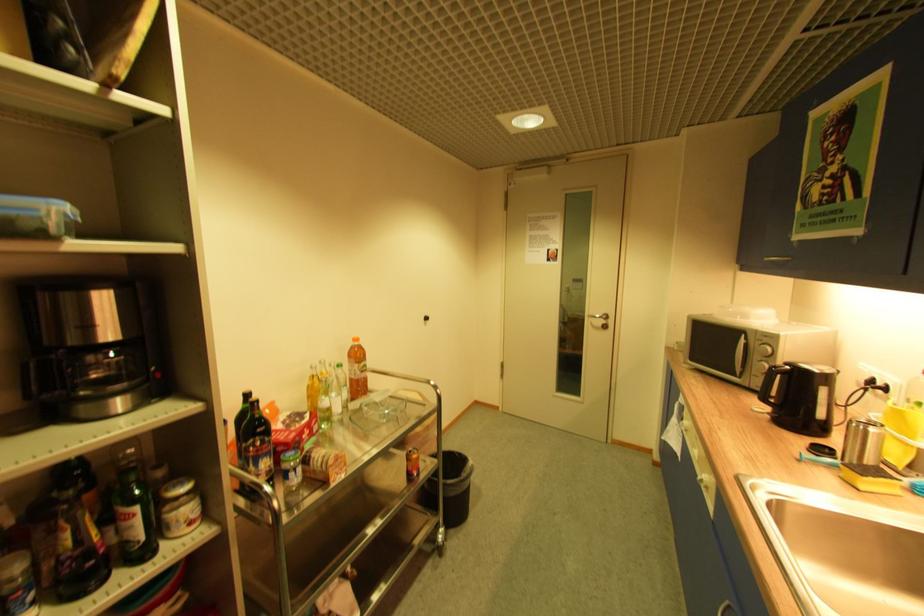
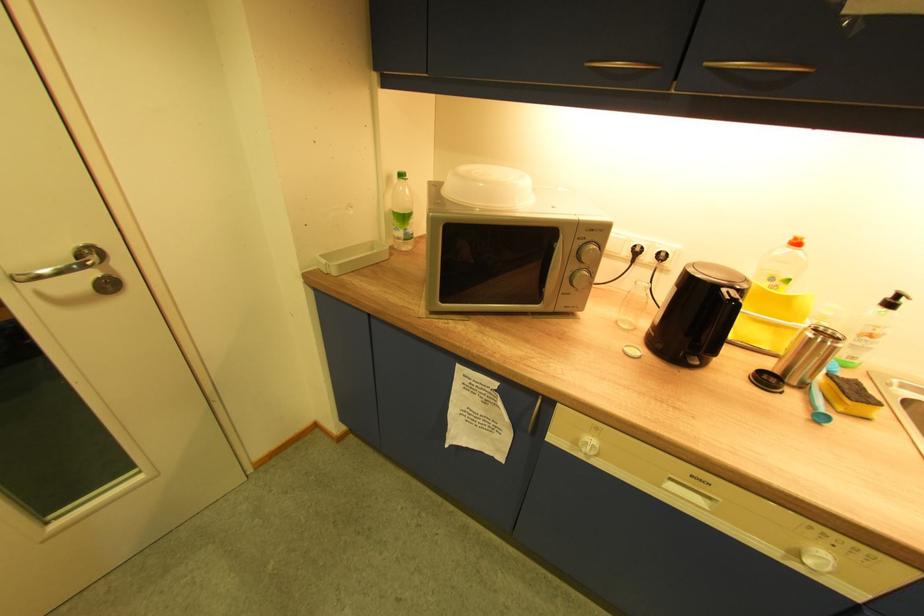
Where in the second image is the point corresponding to (846,477) from the first image?

(843, 413)